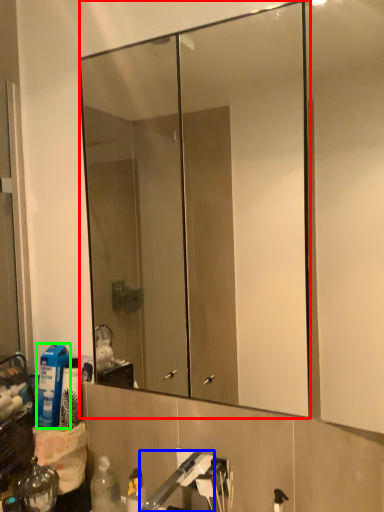
Question: Which is farther away from mirror (highlighted by a red box)? faucet (highlighted by a blue box) or cleaning product (highlighted by a green box)?

Choices:
 (A) faucet
 (B) cleaning product

Answer: (A)